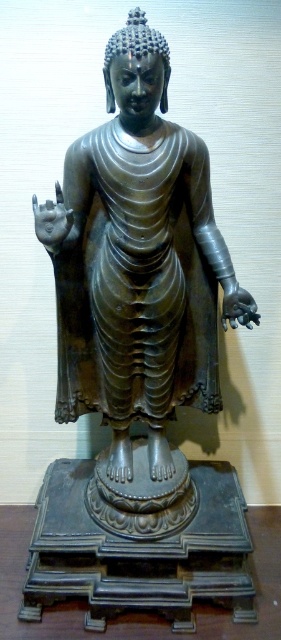
You are an art conservator examining the Buddha statue. You notice two points on the statue, one at point (x=139, y=35) and the other at point (x=141, y=636). Which point is nearer to your viewpoint?

Point (x=139, y=35) is closer to the viewer than point (x=141, y=636).

You are a delivery person who needs to place a 36 inch wide box between the polished bronze statue at center and the polished dark wood table at center. Can the box fit in the space between them?

The distance between the polished bronze statue at center and the polished dark wood table at center is 35.15 inches. Since the box is 36 inches wide, it cannot fit in the space between them.

In the scene shown: You are an art student analyzing the composition of the image. You notice a specific point at coordinates (137, 77). Which object in the scene does this point correspond to?

The point at coordinates (137, 77) corresponds to the polished bronze statue at center.